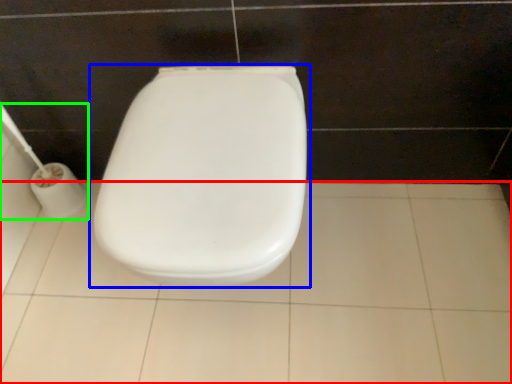
Question: Which is nearer to the ceramic tile (highlighted by a red box)? toilet (highlighted by a blue box) or toilet paper (highlighted by a green box).

Choices:
 (A) toilet
 (B) toilet paper

Answer: (A)